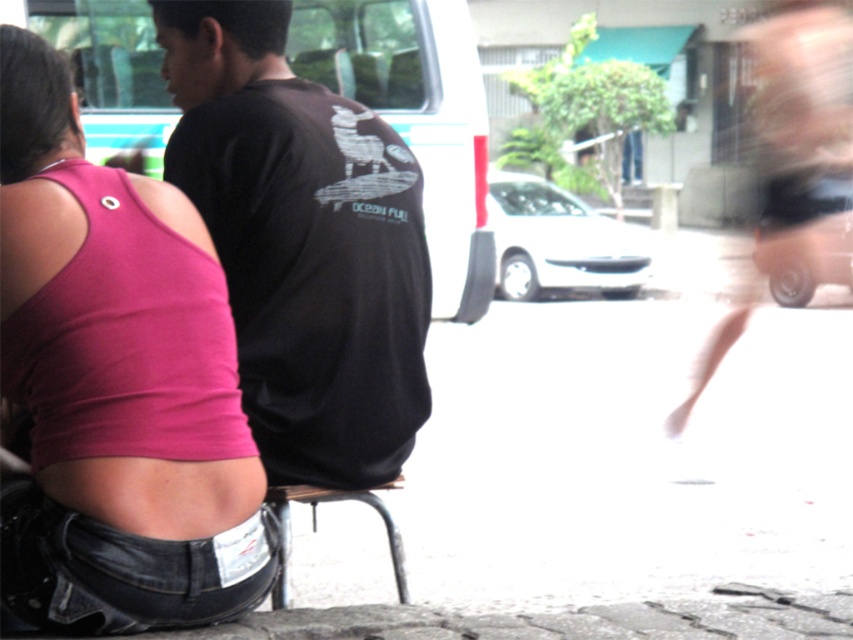
Measure the distance between pink fabric tank top at upper left and camera.

pink fabric tank top at upper left and camera are 2.06 meters apart from each other.

Is pink fabric tank top at upper left further to the viewer compared to metallic silver stool at lower center?

No, it is in front of metallic silver stool at lower center.

Image resolution: width=853 pixels, height=640 pixels. What do you see at coordinates (115, 381) in the screenshot?
I see `pink fabric tank top at upper left` at bounding box center [115, 381].

Locate an element on the screen. This screenshot has height=640, width=853. pink fabric tank top at upper left is located at coordinates (115, 381).

Is black matte t-shirt at upper center shorter than metallic silver stool at lower center?

In fact, black matte t-shirt at upper center may be taller than metallic silver stool at lower center.

Is point (239, 164) positioned after point (402, 556)?

No, it is not.

The width and height of the screenshot is (853, 640). What are the coordinates of `black matte t-shirt at upper center` in the screenshot? It's located at (302, 243).

Can you confirm if pink fabric tank top at upper left is bigger than black matte t-shirt at upper center?

Yes, pink fabric tank top at upper left is bigger than black matte t-shirt at upper center.

Who is more forward, (49, 68) or (177, 184)?

Positioned in front is point (49, 68).

Who is more distant from viewer, (221,474) or (218,138)?

Positioned behind is point (218,138).

Find the location of a particular element. The image size is (853, 640). pink fabric tank top at upper left is located at coordinates (115, 381).